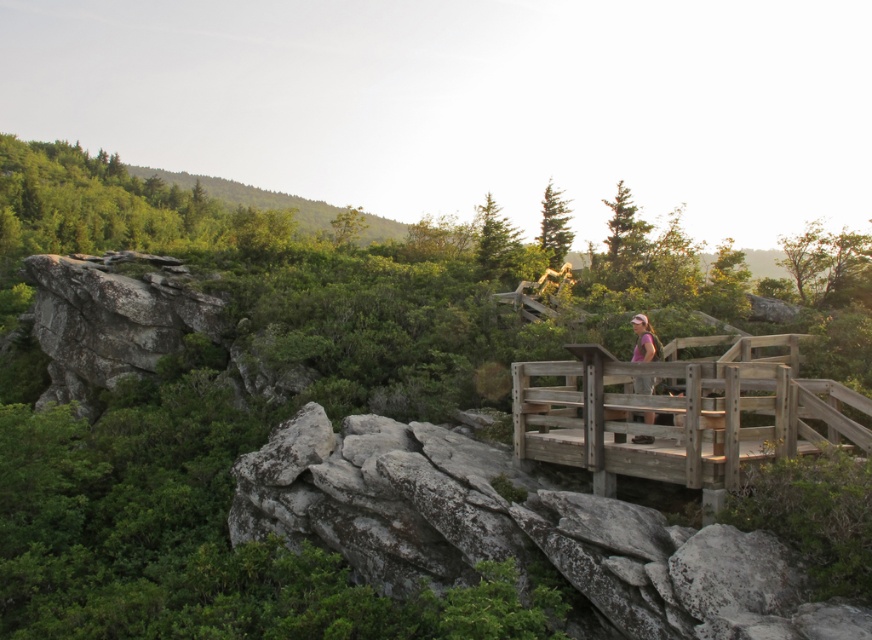
Who is higher up, wooden bridge at center or pink fabric at center-right?

pink fabric at center-right

Identify the location of wooden bridge at center. (678, 413).

What do you see at coordinates (678, 413) in the screenshot? I see `wooden bridge at center` at bounding box center [678, 413].

Identify the location of wooden bridge at center. (678, 413).